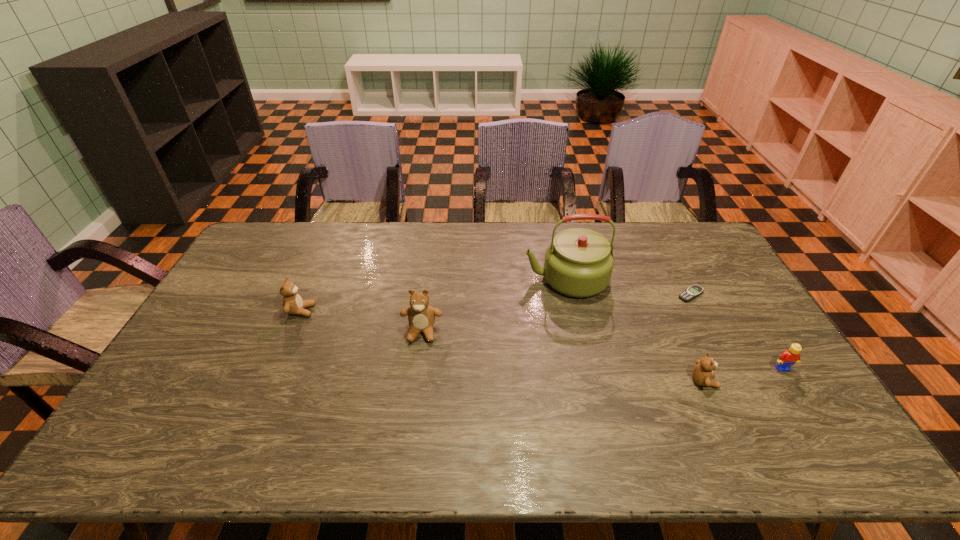
This screenshot has height=540, width=960. I want to click on object located at the near edge, so click(x=702, y=373).

Identify the location of beeper at the right edge. (695, 290).

Locate an element on the screen. Image resolution: width=960 pixels, height=540 pixels. Lego situated at the right edge is located at coordinates (789, 357).

You are a GUI agent. You are given a task and a screenshot of the screen. Output one action in this format:
    pyautogui.click(x=<x>, y=<y>)
    Task: Click on the vacant space at the far edge of the desktop
    Image resolution: width=960 pixels, height=540 pixels.
    Given the screenshot: What is the action you would take?
    pyautogui.click(x=485, y=250)

The image size is (960, 540). I want to click on free space at the far left corner of the desktop, so click(x=289, y=222).

Locate an element on the screen. The height and width of the screenshot is (540, 960). blank space at the far right corner is located at coordinates (689, 226).

Locate an element on the screen. This screenshot has width=960, height=540. vacant point located between the second tallest object and the rightmost object is located at coordinates (602, 350).

Locate an element on the screen. The width and height of the screenshot is (960, 540). free space between the shortest teddy bear and the Lego is located at coordinates (743, 375).

Where is `vacant area that lies between the second tallest teddy bear and the second object from left to right`? vacant area that lies between the second tallest teddy bear and the second object from left to right is located at coordinates (362, 321).

Locate an element on the screen. This screenshot has width=960, height=540. free spot between the Lego and the nearest teddy bear is located at coordinates (743, 375).